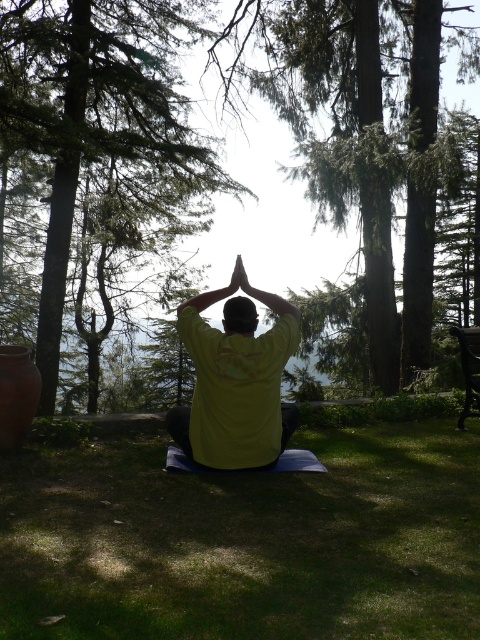
Question: Is yellow matte shirt at center to the right of dark brown wooden bench at right from the viewer's perspective?

Choices:
 (A) yes
 (B) no

Answer: (B)

Question: Is green grass at center smaller than yellow matte shirt at center?

Choices:
 (A) yes
 (B) no

Answer: (A)

Question: Is green grass at center positioned behind yellow matte shirt at center?

Choices:
 (A) yes
 (B) no

Answer: (B)

Question: Which object is farther from the camera taking this photo?

Choices:
 (A) green grass at center
 (B) green leafy tree at center
 (C) dark brown wooden bench at right

Answer: (B)

Question: Among these points, which one is farthest from the camera?

Choices:
 (A) (164, 96)
 (B) (344, 557)
 (C) (469, 339)
 (D) (228, 420)

Answer: (A)

Question: Which of the following is the farthest from the observer?

Choices:
 (A) (46, 356)
 (B) (257, 340)
 (C) (470, 365)

Answer: (A)